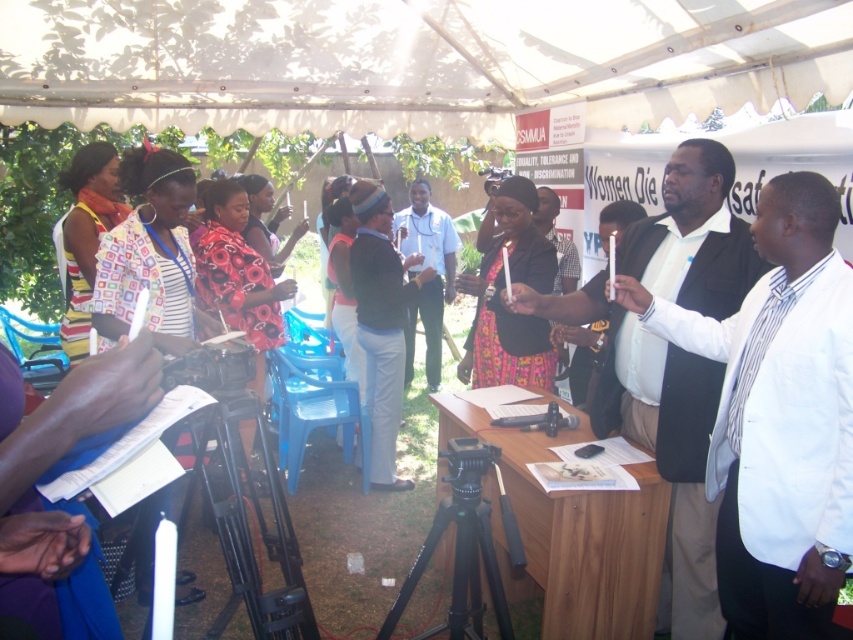
Can you confirm if white glossy shirt at center is positioned below knitted brown hat at center?

Yes.

Based on the photo, which is more to the left, white glossy shirt at center or knitted brown hat at center?

From the viewer's perspective, knitted brown hat at center appears more on the left side.

Is point (782, 307) farther from camera compared to point (381, 368)?

That is False.

Where is `white glossy shirt at center`? white glossy shirt at center is located at coordinates (778, 417).

Does white shirt at center have a larger size compared to knitted brown hat at center?

Yes.

Is white shirt at center shorter than knitted brown hat at center?

No, white shirt at center is not shorter than knitted brown hat at center.

Between point (635, 424) and point (380, 321), which one is positioned behind?

Point (380, 321)

Where is `white shirt at center`? The width and height of the screenshot is (853, 640). white shirt at center is located at coordinates (654, 438).

Is point (643, 435) positioned in front of point (405, 225)?

That is True.

At what (x,y) coordinates should I click in order to perform the action: click on white shirt at center. Please return your answer as a coordinate pair (x, y). This screenshot has width=853, height=640. Looking at the image, I should click on (654, 438).